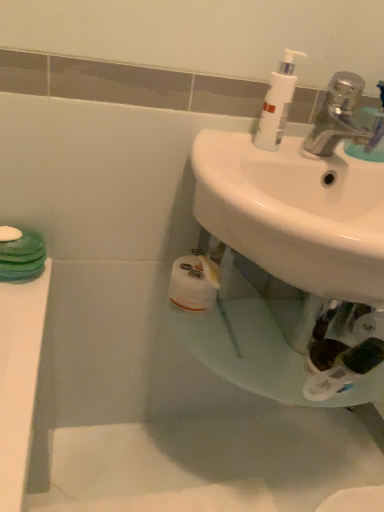
The height and width of the screenshot is (512, 384). What are the coordinates of `vacant area situated to the left side of silver metallic faucet at upper right` in the screenshot? It's located at (259, 154).